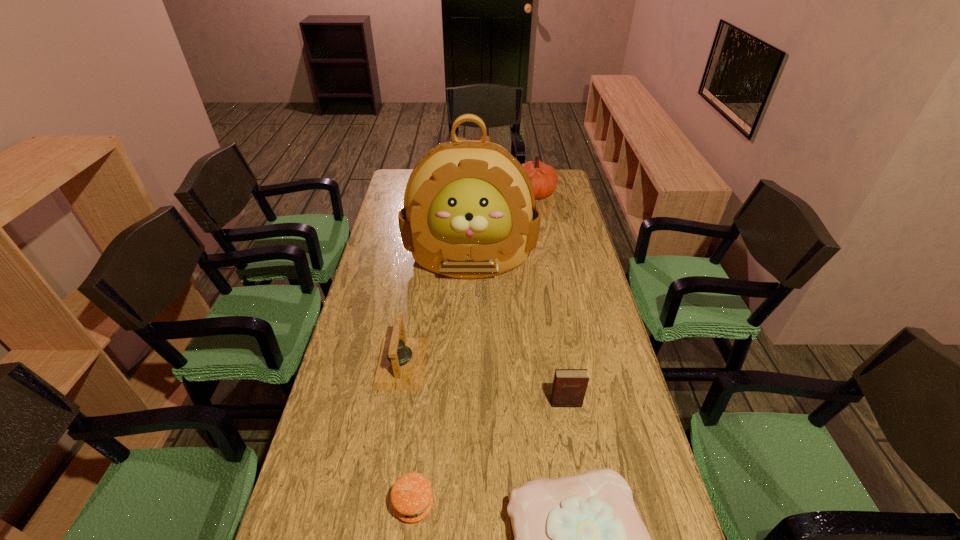
Where is `free region located on the front-facing side of the pumpkin`? This screenshot has width=960, height=540. free region located on the front-facing side of the pumpkin is located at coordinates (453, 192).

The image size is (960, 540). In order to click on vacant point located 0.250m on the right of the fourth nearest object in this screenshot , I will do `click(509, 363)`.

At what (x,y) coordinates should I click in order to perform the action: click on free spot located on the front cover of the third nearest object. Please return your answer as a coordinate pair (x, y). The width and height of the screenshot is (960, 540). Looking at the image, I should click on (587, 530).

This screenshot has height=540, width=960. Identify the location of free space located 0.120m on the back of the patty. (421, 437).

Find the location of a particular element. The image size is (960, 540). object located in the far edge section of the desktop is located at coordinates (x=543, y=177).

Locate an element on the screen. This screenshot has height=540, width=960. backpack at the left edge is located at coordinates (469, 211).

Image resolution: width=960 pixels, height=540 pixels. I want to click on bell located at the left edge, so click(x=401, y=363).

The image size is (960, 540). I want to click on pumpkin at the right edge, so click(x=543, y=177).

You are a GUI agent. You are given a task and a screenshot of the screen. Output one action in this format:
    pyautogui.click(x=<x>, y=<y>)
    Task: Click on the diary that is at the right edge
    The height and width of the screenshot is (540, 960).
    Given the screenshot: What is the action you would take?
    pyautogui.click(x=569, y=387)

Find the location of `object at the far right corner`. object at the far right corner is located at coordinates [x=543, y=177].